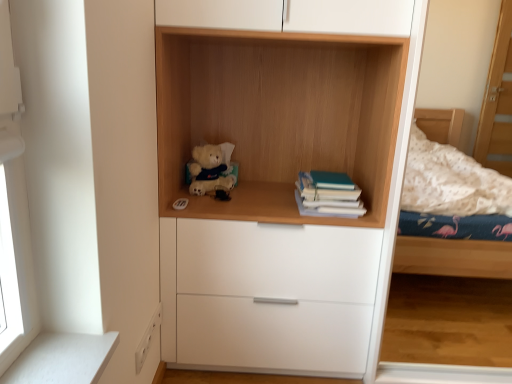
Question: Is soft plush teddy bear at center spatially inside teal matte book at right, or outside of it?

Choices:
 (A) inside
 (B) outside

Answer: (B)

Question: Looking at their shapes, would you say soft plush teddy bear at center is wider or thinner than teal matte book at right?

Choices:
 (A) thin
 (B) wide

Answer: (A)

Question: Which of these objects is positioned farthest from the white matte chest of drawers at center?

Choices:
 (A) wooden shelf at center
 (B) soft plush teddy bear at center
 (C) teal matte book at right

Answer: (B)

Question: Which object is the closest to the white matte chest of drawers at center?

Choices:
 (A) soft plush teddy bear at center
 (B) wooden shelf at center
 (C) teal matte book at right

Answer: (C)